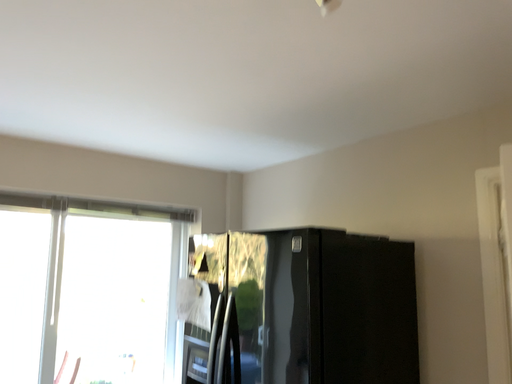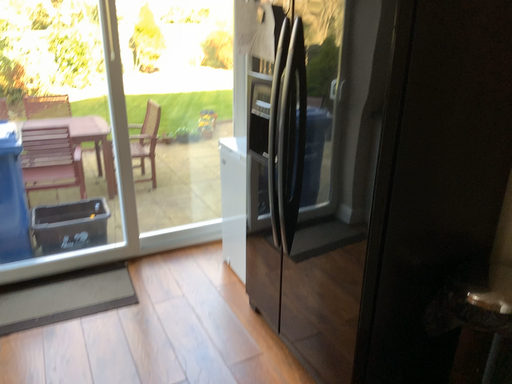
Question: Which way did the camera rotate in the video?

Choices:
 (A) rotated left
 (B) rotated right

Answer: (A)